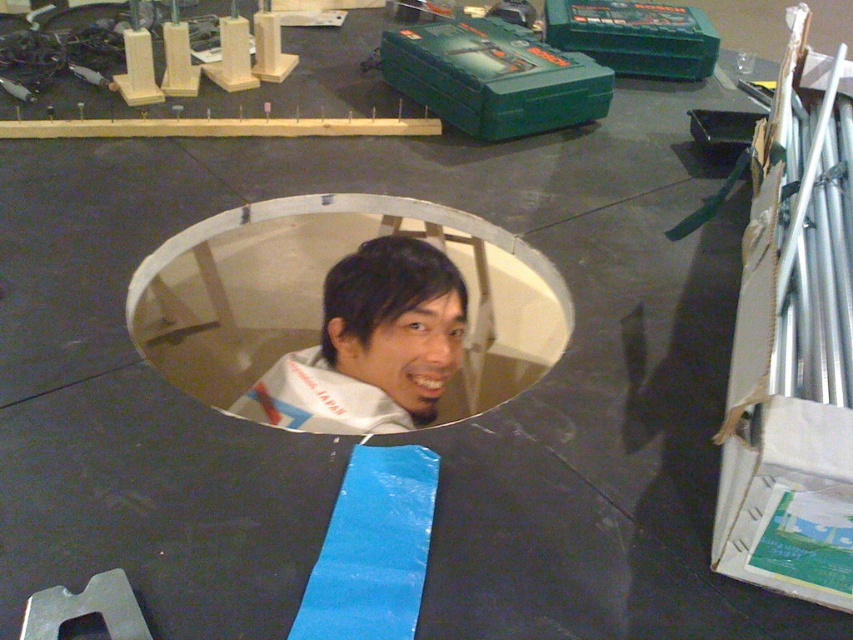
Can you confirm if white plastic hole at center is positioned above white fabric at center?

Correct, white plastic hole at center is located above white fabric at center.

Does white plastic hole at center appear on the left side of white fabric at center?

Correct, you'll find white plastic hole at center to the left of white fabric at center.

Locate an element on the screen. white plastic hole at center is located at coordinates (320, 298).